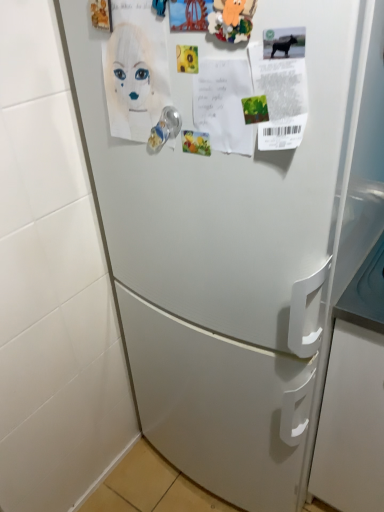
Question: Considering the relative positions of clear plastic door handle at center and white paper at upper left in the image provided, is clear plastic door handle at center in front of white paper at upper left?

Choices:
 (A) no
 (B) yes

Answer: (A)

Question: Does clear plastic door handle at center have a lesser width compared to white paper at upper left?

Choices:
 (A) yes
 (B) no

Answer: (A)

Question: Is clear plastic door handle at center facing away from white paper at upper left?

Choices:
 (A) yes
 (B) no

Answer: (A)

Question: Considering the relative sizes of clear plastic door handle at center and white paper at upper left in the image provided, is clear plastic door handle at center wider than white paper at upper left?

Choices:
 (A) yes
 (B) no

Answer: (B)

Question: Does clear plastic door handle at center have a lesser height compared to white paper at upper left?

Choices:
 (A) yes
 (B) no

Answer: (A)

Question: Does clear plastic door handle at center appear on the right side of white paper at upper left?

Choices:
 (A) no
 (B) yes

Answer: (B)

Question: Is the depth of white paper at upper left greater than that of clear plastic door handle at center?

Choices:
 (A) no
 (B) yes

Answer: (A)

Question: Is white paper at upper left facing away from clear plastic door handle at center?

Choices:
 (A) yes
 (B) no

Answer: (A)

Question: Is white paper at upper left at the right side of clear plastic door handle at center?

Choices:
 (A) no
 (B) yes

Answer: (A)

Question: Considering the relative sizes of white paper at upper left and clear plastic door handle at center in the image provided, is white paper at upper left wider than clear plastic door handle at center?

Choices:
 (A) yes
 (B) no

Answer: (A)

Question: Does white paper at upper left lie in front of clear plastic door handle at center?

Choices:
 (A) yes
 (B) no

Answer: (A)

Question: Considering the relative sizes of white paper at upper left and clear plastic door handle at center in the image provided, is white paper at upper left taller than clear plastic door handle at center?

Choices:
 (A) no
 (B) yes

Answer: (B)

Question: Considering their positions, is white paper at upper left located in front of or behind clear plastic door handle at center?

Choices:
 (A) front
 (B) behind

Answer: (A)